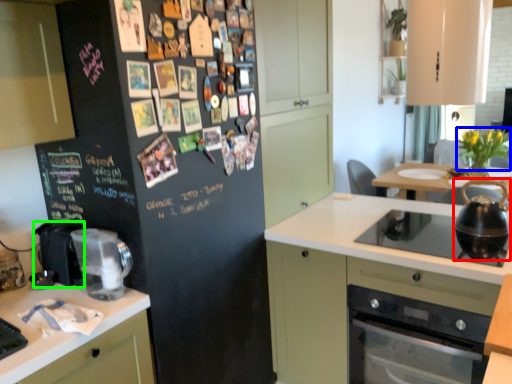
Question: Estimate the real-world distances between objects in this image. Which object is closer to kitchen appliance (highlighted by a red box), flower (highlighted by a blue box) or appliance (highlighted by a green box)?

Choices:
 (A) flower
 (B) appliance

Answer: (A)